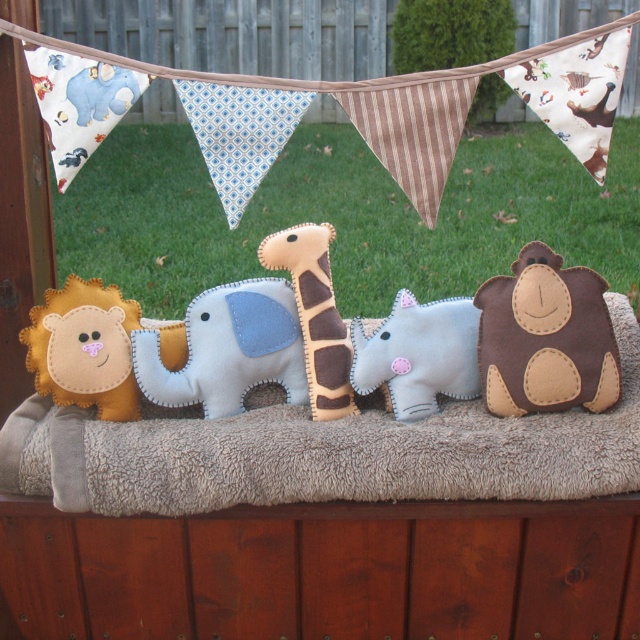
Locate an element on the screen. felt elephant at center is located at coordinates (227, 349).

Based on the photo, between felt elephant at center and soft felt giraffe at center, which one has more height?

soft felt giraffe at center

Who is more distant from viewer, (148, 330) or (305, 300)?

Positioned behind is point (148, 330).

This screenshot has height=640, width=640. Find the location of `felt elephant at center`. felt elephant at center is located at coordinates (x=227, y=349).

Who is more forward, (509, 356) or (246, 300)?

Point (509, 356) is in front.

Where is `brown felt monkey at center`? This screenshot has height=640, width=640. brown felt monkey at center is located at coordinates (x=545, y=337).

Is point (550, 259) in front of point (214, 360)?

Yes, point (550, 259) is in front of point (214, 360).

At what (x,y) coordinates should I click in order to perform the action: click on brown felt monkey at center. Please return your answer as a coordinate pair (x, y). Image resolution: width=640 pixels, height=640 pixels. Looking at the image, I should click on (545, 337).

Does white felt baby elephant at center have a lesser height compared to soft felt giraffe at center?

Correct, white felt baby elephant at center is not as tall as soft felt giraffe at center.

Can you confirm if white felt baby elephant at center is positioned to the left of soft felt giraffe at center?

Incorrect, white felt baby elephant at center is not on the left side of soft felt giraffe at center.

What are the coordinates of `white felt baby elephant at center` in the screenshot? It's located at (419, 355).